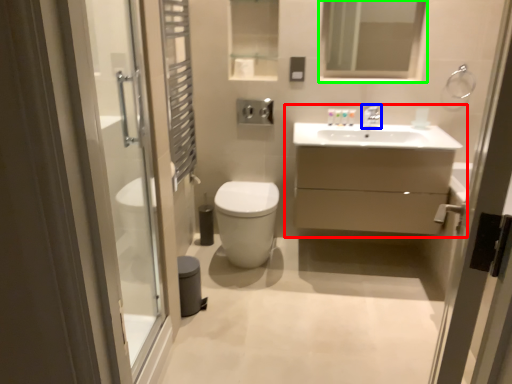
Question: Estimate the real-world distances between objects in this image. Which object is closer to bathroom cabinet (highlighted by a red box), tap (highlighted by a blue box) or mirror (highlighted by a green box)?

Choices:
 (A) tap
 (B) mirror

Answer: (A)